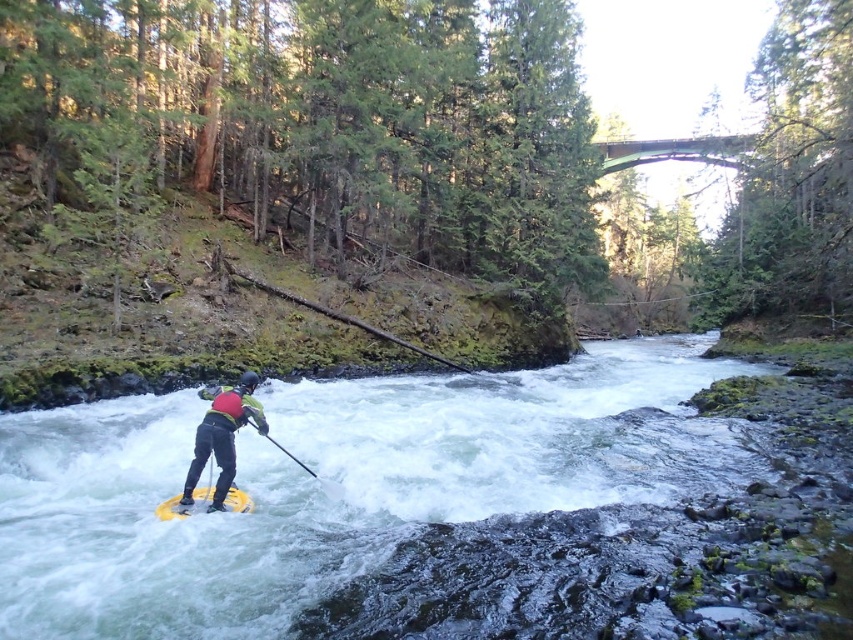
Question: Can you confirm if yellow rubber paddleboard at center is positioned above black plastic paddle at center?

Choices:
 (A) no
 (B) yes

Answer: (B)

Question: Among these points, which one is nearest to the camera?

Choices:
 (A) (260, 513)
 (B) (235, 388)

Answer: (A)

Question: Is yellow foam paddle at center closer to camera compared to black plastic paddle at center?

Choices:
 (A) yes
 (B) no

Answer: (A)

Question: Which is nearer to the yellow rubber paddleboard at center?

Choices:
 (A) yellow foam paddle at center
 (B) yellow rubber canoe at center

Answer: (B)

Question: Can you confirm if yellow rubber paddleboard at center is smaller than black plastic paddle at center?

Choices:
 (A) no
 (B) yes

Answer: (A)

Question: Which point is farther to the camera?

Choices:
 (A) (260, 433)
 (B) (527, 540)
 (C) (212, 401)

Answer: (C)